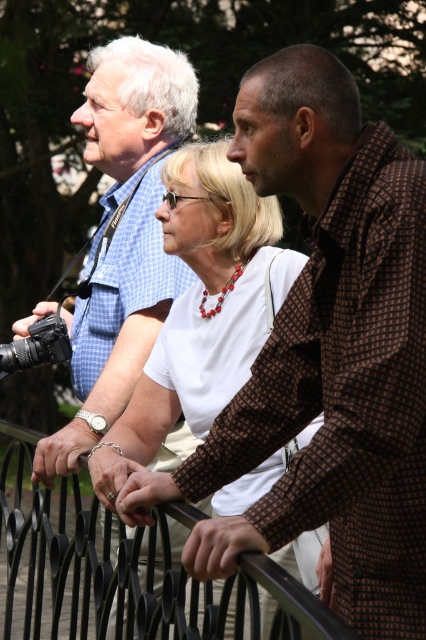
Can you confirm if white matte shirt at center is wider than black wrought iron fence at center?

Incorrect, white matte shirt at center's width does not surpass black wrought iron fence at center's.

Does point (221, 189) lie in front of point (72, 628)?

Yes, it is in front of point (72, 628).

Identify the location of white matte shirt at center. Image resolution: width=426 pixels, height=640 pixels. (203, 307).

Does black wrought iron fence at center have a lesser height compared to black plastic camera at left?

No.

Which is more to the left, black wrought iron fence at center or black plastic camera at left?

From the viewer's perspective, black plastic camera at left appears more on the left side.

Between point (313, 636) and point (8, 348), which one is positioned in front?

Positioned in front is point (313, 636).

What are the coordinates of `black wrought iron fence at center` in the screenshot? It's located at (94, 563).

What do you see at coordinates (203, 307) in the screenshot? I see `white matte shirt at center` at bounding box center [203, 307].

Can you confirm if white matte shirt at center is wider than black plastic camera at left?

Yes.

Which is behind, point (249, 193) or point (60, 360)?

The point (60, 360) is behind.

Where is `white matte shirt at center`? The width and height of the screenshot is (426, 640). white matte shirt at center is located at coordinates (203, 307).